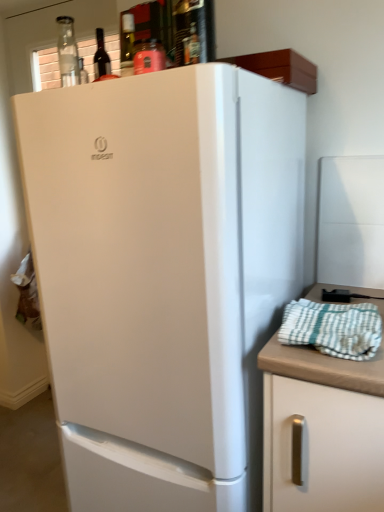
Question: Can you confirm if white checkered towel at right is thinner than white matte cabinet at right?

Choices:
 (A) yes
 (B) no

Answer: (A)

Question: Considering the relative sizes of white checkered towel at right and white matte cabinet at right in the image provided, is white checkered towel at right smaller than white matte cabinet at right?

Choices:
 (A) yes
 (B) no

Answer: (A)

Question: Considering the relative sizes of white checkered towel at right and white matte cabinet at right in the image provided, is white checkered towel at right wider than white matte cabinet at right?

Choices:
 (A) no
 (B) yes

Answer: (A)

Question: From a real-world perspective, is white checkered towel at right positioned under white matte cabinet at right based on gravity?

Choices:
 (A) no
 (B) yes

Answer: (A)

Question: Is white checkered towel at right taller than white matte cabinet at right?

Choices:
 (A) no
 (B) yes

Answer: (A)

Question: Is white checkered towel at right at the left side of white matte cabinet at right?

Choices:
 (A) yes
 (B) no

Answer: (A)

Question: Are white matte refrigerator at center and matte glass wine bottle at upper center beside each other?

Choices:
 (A) yes
 (B) no

Answer: (B)

Question: Is white matte refrigerator at center oriented away from matte glass wine bottle at upper center?

Choices:
 (A) yes
 (B) no

Answer: (B)

Question: From the image's perspective, does white matte refrigerator at center appear higher than matte glass wine bottle at upper center?

Choices:
 (A) yes
 (B) no

Answer: (B)

Question: Does white matte refrigerator at center appear on the right side of matte glass wine bottle at upper center?

Choices:
 (A) yes
 (B) no

Answer: (A)

Question: Considering the relative positions of white matte refrigerator at center and matte glass wine bottle at upper center in the image provided, is white matte refrigerator at center behind matte glass wine bottle at upper center?

Choices:
 (A) no
 (B) yes

Answer: (A)

Question: Can you confirm if white matte refrigerator at center is wider than matte glass wine bottle at upper center?

Choices:
 (A) yes
 (B) no

Answer: (A)

Question: Is white matte refrigerator at center further to the viewer compared to white matte cabinet at right?

Choices:
 (A) no
 (B) yes

Answer: (A)